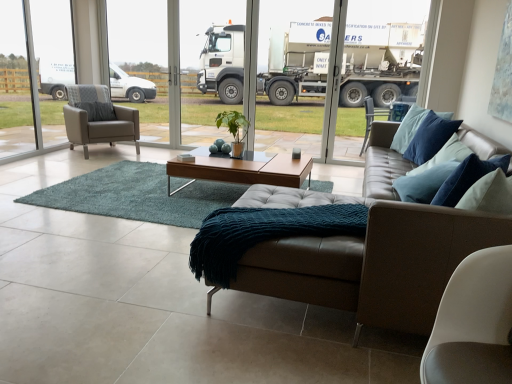
Question: Looking at the image, does matte gray armchair at left seem bigger or smaller compared to white glossy truck at upper center?

Choices:
 (A) small
 (B) big

Answer: (B)

Question: Considering the positions of point (72, 92) and point (242, 1), is point (72, 92) closer or farther from the camera than point (242, 1)?

Choices:
 (A) farther
 (B) closer

Answer: (B)

Question: Which of these objects is positioned closest to the brown leather couch at center?

Choices:
 (A) matte gray armchair at left
 (B) matte gray armchair at left
 (C) white glossy truck at upper center
 (D) teal knitted blanket at center
 (E) light brown wood coffee table at center

Answer: (D)

Question: Estimate the real-world distances between objects in this image. Which object is farther from the brown leather couch at center?

Choices:
 (A) teal knitted blanket at center
 (B) white glossy truck at upper center
 (C) matte gray armchair at left
 (D) matte gray armchair at left
 (E) light brown wood coffee table at center

Answer: (B)